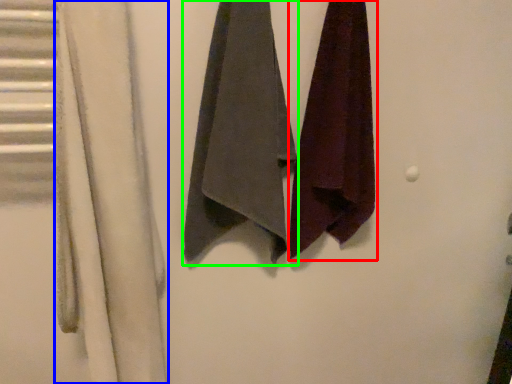
Question: Based on their relative distances, which object is nearer to towel (highlighted by a red box)? Choose from curtain (highlighted by a blue box) and towel (highlighted by a green box).

Choices:
 (A) curtain
 (B) towel

Answer: (B)